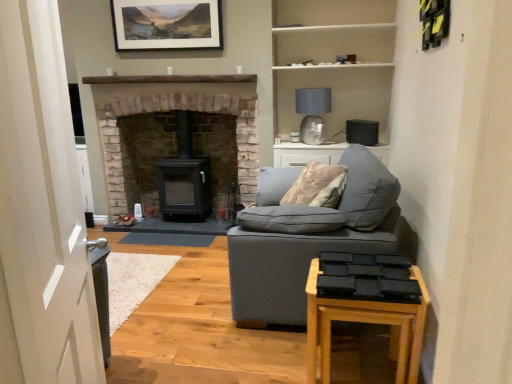
This screenshot has height=384, width=512. What do you see at coordinates (334, 43) in the screenshot?
I see `white matte shelves at upper center` at bounding box center [334, 43].

Measure the distance between white matte shelves at upper center and camera.

They are 3.85 meters apart.

You are a GUI agent. You are given a task and a screenshot of the screen. Output one action in this format:
    pyautogui.click(x=<x>, y=<y>)
    Task: Click on the brick fireplace at center
    The image size is (512, 384).
    Given the screenshot: What is the action you would take?
    pyautogui.click(x=167, y=110)

Measure the distance between point (x=248, y=80) and camera.

They are 3.88 meters apart.

What is the approximate height of matte gray fabric couch at center?

matte gray fabric couch at center is 37.67 inches in height.

At what (x,y) coordinates should I click in order to perform the action: click on white matte shelves at upper center. Please return your answer as a coordinate pair (x, y). Image resolution: width=512 pixels, height=384 pixels. Looking at the image, I should click on (334, 43).

Is point (138, 82) in front of point (349, 150)?

No, it is not.

Between brick fireplace at center and soft gray fabric couch at center, which one has larger size?

brick fireplace at center is bigger.

In the scene shown: Does brick fireplace at center appear on the left side of soft gray fabric couch at center?

Correct, you'll find brick fireplace at center to the left of soft gray fabric couch at center.

What's the angular difference between matte wooden picture frame at upper center and matte glass lampshade at upper center's facing directions?

The angular difference between matte wooden picture frame at upper center and matte glass lampshade at upper center is 4.4 degrees.

From the image's perspective, is matte wooden picture frame at upper center above or below matte glass lampshade at upper center?

From the image's perspective, matte wooden picture frame at upper center appears above matte glass lampshade at upper center.

Between matte wooden picture frame at upper center and matte glass lampshade at upper center, which one has larger size?

With larger size is matte glass lampshade at upper center.

Locate an element on the screen. The image size is (512, 384). lamp below the matte wooden picture frame at upper center (from the image's perspective) is located at coordinates (313, 113).

From the image's perspective, is matte gray fabric couch at center positioned above or below brick fireplace at center?

matte gray fabric couch at center is below brick fireplace at center.

Is there a large distance between matte gray fabric couch at center and brick fireplace at center?

Yes, matte gray fabric couch at center is far from brick fireplace at center.

Looking at this image, could you tell me if matte gray fabric couch at center is turned towards brick fireplace at center?

No, matte gray fabric couch at center is not facing towards brick fireplace at center.

Which of these two, matte gray fabric couch at center or brick fireplace at center, stands shorter?

Standing shorter between the two is matte gray fabric couch at center.

Is soft gray fabric couch at center further to camera compared to matte wooden picture frame at upper center?

No, soft gray fabric couch at center is closer to the camera.

Between soft gray fabric couch at center and matte wooden picture frame at upper center, which one has less height?

matte wooden picture frame at upper center.

Considering the relative sizes of soft gray fabric couch at center and matte wooden picture frame at upper center in the image provided, is soft gray fabric couch at center wider than matte wooden picture frame at upper center?

Yes, soft gray fabric couch at center is wider than matte wooden picture frame at upper center.

In terms of size, does soft gray fabric couch at center appear bigger or smaller than matte wooden picture frame at upper center?

Clearly, soft gray fabric couch at center is larger in size than matte wooden picture frame at upper center.

The width and height of the screenshot is (512, 384). I want to click on fireplace below the matte glass lampshade at upper center (from a real-world perspective), so click(x=167, y=110).

Considering the positions of objects matte glass lampshade at upper center and brick fireplace at center in the image provided, who is more to the left, matte glass lampshade at upper center or brick fireplace at center?

Positioned to the left is brick fireplace at center.

From a real-world perspective, is matte glass lampshade at upper center above or below brick fireplace at center?

From a real-world perspective, matte glass lampshade at upper center is physically above brick fireplace at center.

Which object is further away from the camera, matte glass lampshade at upper center or brick fireplace at center?

matte glass lampshade at upper center.

Could you tell me if white matte shelves at upper center is turned towards wooden side table at lower right?

No, white matte shelves at upper center is not facing towards wooden side table at lower right.

Can we say white matte shelves at upper center lies outside wooden side table at lower right?

That's correct, white matte shelves at upper center is outside of wooden side table at lower right.

Can you tell me how much white matte shelves at upper center and wooden side table at lower right differ in facing direction?

They differ by 90 degrees in their facing directions.

Looking at this image, based on their sizes in the image, would you say white matte shelves at upper center is bigger or smaller than wooden side table at lower right?

In the image, white matte shelves at upper center appears to be larger than wooden side table at lower right.

Based on the photo, is there a large distance between brick fireplace at center and wooden side table at lower right?

brick fireplace at center is far away from wooden side table at lower right.

Considering the sizes of objects brick fireplace at center and wooden side table at lower right in the image provided, who is thinner, brick fireplace at center or wooden side table at lower right?

wooden side table at lower right.

Considering the positions of objects brick fireplace at center and wooden side table at lower right in the image provided, who is behind, brick fireplace at center or wooden side table at lower right?

Positioned behind is brick fireplace at center.

Locate an element on the screen. This screenshot has height=384, width=512. sit that is on the right side of brick fireplace at center is located at coordinates (325, 208).

This screenshot has width=512, height=384. I want to click on lamp behind the matte wooden picture frame at upper center, so click(x=313, y=113).

Which object lies further to the anchor point white glossy door at left, brick fireplace at center or wooden side table at lower right?

Based on the image, brick fireplace at center appears to be further to white glossy door at left.

When comparing their distances from soft gray fabric couch at center, does matte glass lampshade at upper center or matte gray fabric couch at center seem closer?

matte gray fabric couch at center is positioned closer to the anchor soft gray fabric couch at center.

Considering their positions, is white matte shelves at upper center positioned closer to white glossy door at left than wooden side table at lower right?

wooden side table at lower right.

Estimate the real-world distances between objects in this image. Which object is closer to soft gray fabric couch at center, white matte shelves at upper center or white glossy door at left?

Among the two, white glossy door at left is located nearer to soft gray fabric couch at center.

Estimate the real-world distances between objects in this image. Which object is closer to soft gray fabric couch at center, matte glass lampshade at upper center or brick fireplace at center?

The object closer to soft gray fabric couch at center is matte glass lampshade at upper center.

Looking at the image, which one is located further to matte glass lampshade at upper center, brick fireplace at center or soft gray fabric couch at center?

soft gray fabric couch at center lies further to matte glass lampshade at upper center than the other object.

Based on their spatial positions, is white matte shelves at upper center or wooden side table at lower right closer to soft gray fabric couch at center?

wooden side table at lower right is positioned closer to the anchor soft gray fabric couch at center.

Estimate the real-world distances between objects in this image. Which object is further from matte gray fabric couch at center, brick fireplace at center or soft gray fabric couch at center?

Among the two, brick fireplace at center is located further to matte gray fabric couch at center.

At what (x,y) coordinates should I click in order to perform the action: click on fireplace positioned between white glossy door at left and black matte wood burning stove at center from near to far. Please return your answer as a coordinate pair (x, y). The height and width of the screenshot is (384, 512). Looking at the image, I should click on (167, 110).

Where is `shelf between white glossy door at left and matte wooden picture frame at upper center from front to back`? The image size is (512, 384). shelf between white glossy door at left and matte wooden picture frame at upper center from front to back is located at coordinates click(334, 43).

At what (x,y) coordinates should I click in order to perform the action: click on fireplace between matte wooden picture frame at upper center and white matte shelves at upper center from left to right. Please return your answer as a coordinate pair (x, y). The height and width of the screenshot is (384, 512). Looking at the image, I should click on (167, 110).

Where is `wood burning stove between brick fireplace at center and matte glass lampshade at upper center`? wood burning stove between brick fireplace at center and matte glass lampshade at upper center is located at coordinates (184, 177).